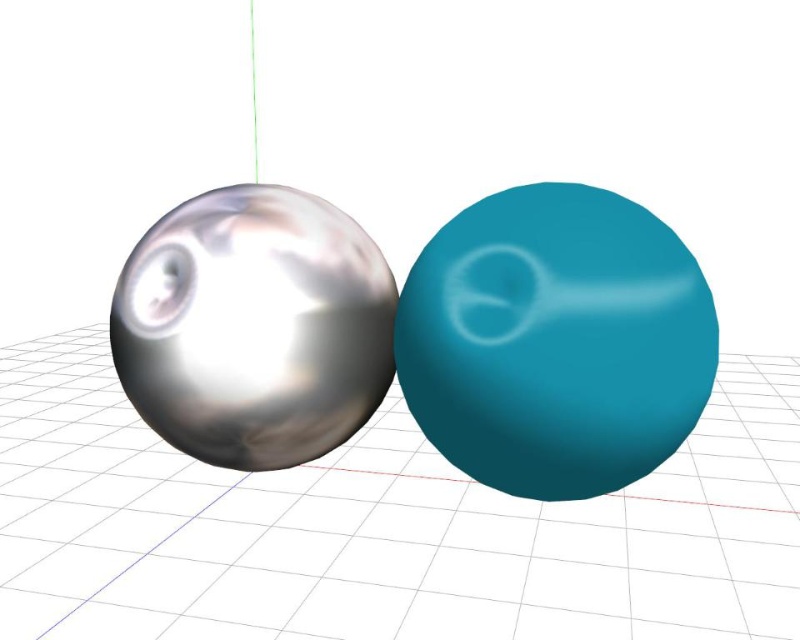
You are an artist trying to create a sculpture that requires precise measurements. You have two objects in front of you, the metallic sphere at center and the teal rubber bowling ball at center. Which object should you choose if you need the larger one for your sculpture?

The metallic sphere at center is bigger than the teal rubber bowling ball at center, so you should choose the metallic sphere at center for your sculpture.

Based on the photo, you are an architect designing a 3D model and see the metallic sphere at center and the point at coordinates (381, 528). Can you confirm if the point is located at the center of the metallic sphere at center?

Yes, the point at coordinates (381, 528) is located at the center of the metallic sphere at center as indicated by the description.